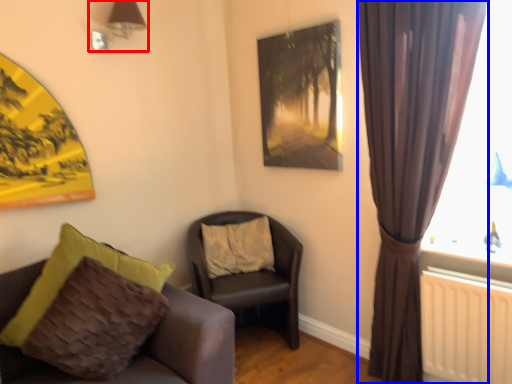
Question: Among these objects, which one is farthest to the camera, lamp (highlighted by a red box) or curtain (highlighted by a blue box)?

Choices:
 (A) lamp
 (B) curtain

Answer: (A)